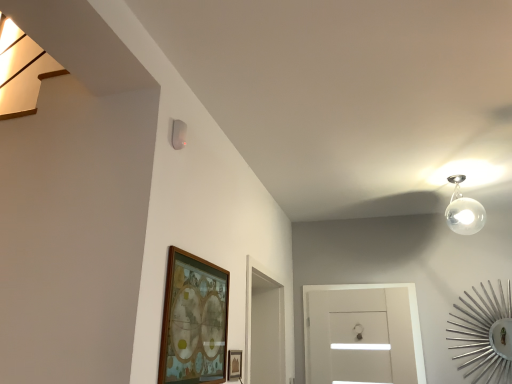
Question: Is wooden picture frame at lower center, which ranks as the 1th picture frame in right-to-left order, completely or partially outside of wooden framed artwork at lower center, the first picture frame when ordered from left to right?

Choices:
 (A) yes
 (B) no

Answer: (A)

Question: Considering the relative sizes of wooden picture frame at lower center, the second picture frame when ordered from left to right, and wooden framed artwork at lower center, which appears as the 2th picture frame when viewed from the right, in the image provided, is wooden picture frame at lower center, the second picture frame when ordered from left to right, wider than wooden framed artwork at lower center, which appears as the 2th picture frame when viewed from the right,?

Choices:
 (A) no
 (B) yes

Answer: (A)

Question: From the image's perspective, is wooden picture frame at lower center, which ranks as the 1th picture frame in right-to-left order, over wooden framed artwork at lower center, the first picture frame when ordered from left to right?

Choices:
 (A) no
 (B) yes

Answer: (A)

Question: Could you tell me if wooden picture frame at lower center, the second picture frame when ordered from left to right, is facing wooden framed artwork at lower center, the first picture frame when ordered from left to right?

Choices:
 (A) yes
 (B) no

Answer: (B)

Question: Would you say wooden picture frame at lower center, which ranks as the 1th picture frame in right-to-left order, is a long distance from wooden framed artwork at lower center, which appears as the 2th picture frame when viewed from the right?

Choices:
 (A) yes
 (B) no

Answer: (B)

Question: From a real-world perspective, relative to wooden picture frame at lower center, the second picture frame when ordered from left to right, is transparent glass door at center vertically above or below?

Choices:
 (A) above
 (B) below

Answer: (A)

Question: Considering the positions of transparent glass door at center and wooden picture frame at lower center, the second picture frame when ordered from left to right, in the image, is transparent glass door at center bigger or smaller than wooden picture frame at lower center, the second picture frame when ordered from left to right,?

Choices:
 (A) small
 (B) big

Answer: (B)

Question: Considering their positions, is transparent glass door at center located in front of or behind wooden picture frame at lower center, which ranks as the 1th picture frame in right-to-left order?

Choices:
 (A) front
 (B) behind

Answer: (B)

Question: Based on their positions, is transparent glass door at center located to the left or right of wooden picture frame at lower center, the second picture frame when ordered from left to right?

Choices:
 (A) right
 (B) left

Answer: (A)

Question: Is wooden framed artwork at lower center, which appears as the 2th picture frame when viewed from the right, taller or shorter than transparent glass door at center?

Choices:
 (A) short
 (B) tall

Answer: (A)

Question: From a real-world perspective, relative to transparent glass door at center, is wooden framed artwork at lower center, which appears as the 2th picture frame when viewed from the right, vertically above or below?

Choices:
 (A) above
 (B) below

Answer: (A)

Question: From the image's perspective, relative to transparent glass door at center, is wooden framed artwork at lower center, which appears as the 2th picture frame when viewed from the right, above or below?

Choices:
 (A) below
 (B) above

Answer: (B)

Question: In the image, is wooden framed artwork at lower center, the first picture frame when ordered from left to right, positioned in front of or behind transparent glass door at center?

Choices:
 (A) behind
 (B) front

Answer: (B)

Question: From a real-world perspective, is wooden framed artwork at lower center, which appears as the 2th picture frame when viewed from the right, above or below wooden picture frame at lower center, which ranks as the 1th picture frame in right-to-left order?

Choices:
 (A) below
 (B) above

Answer: (B)

Question: Considering the positions of wooden framed artwork at lower center, the first picture frame when ordered from left to right, and wooden picture frame at lower center, which ranks as the 1th picture frame in right-to-left order, in the image, is wooden framed artwork at lower center, the first picture frame when ordered from left to right, wider or thinner than wooden picture frame at lower center, which ranks as the 1th picture frame in right-to-left order,?

Choices:
 (A) thin
 (B) wide

Answer: (B)